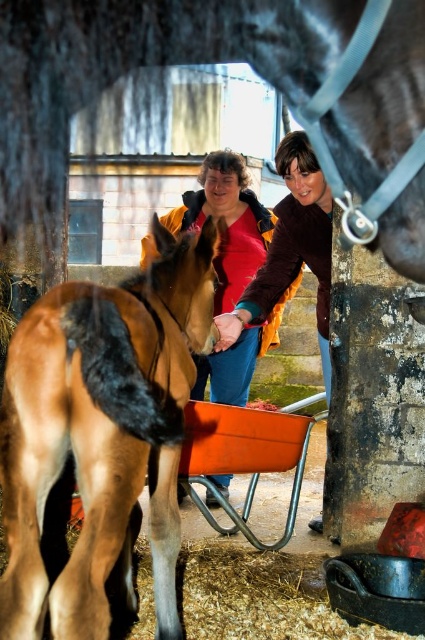
Question: Which object is closer to the camera taking this photo?

Choices:
 (A) matte brown jacket at center
 (B) matte red vest at center
 (C) brown glossy horse at center

Answer: (C)

Question: Estimate the real-world distances between objects in this image. Which object is closer to the matte brown jacket at center?

Choices:
 (A) matte red vest at center
 (B) brown glossy horse at center

Answer: (A)

Question: Which of these objects is positioned closest to the matte brown jacket at center?

Choices:
 (A) brown glossy horse at center
 (B) matte red vest at center

Answer: (B)

Question: Is matte red vest at center to the right of matte brown jacket at center from the viewer's perspective?

Choices:
 (A) no
 (B) yes

Answer: (A)

Question: Does brown glossy horse at center appear on the right side of matte brown jacket at center?

Choices:
 (A) yes
 (B) no

Answer: (B)

Question: Is brown glossy horse at center further to the viewer compared to matte red vest at center?

Choices:
 (A) no
 (B) yes

Answer: (A)